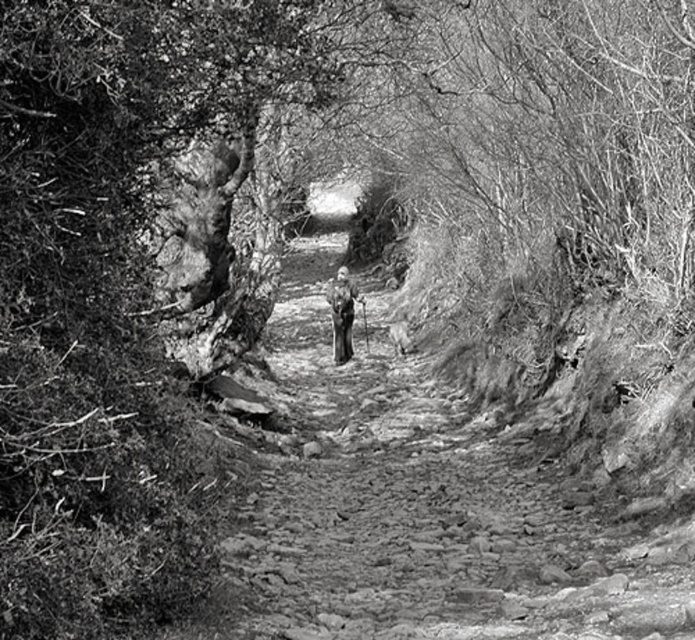
Does dirt path at center appear on the left side of dark gray fabric jacket at center?

In fact, dirt path at center is to the right of dark gray fabric jacket at center.

What do you see at coordinates (427, 509) in the screenshot? I see `dirt path at center` at bounding box center [427, 509].

Identify the location of dirt path at center. (427, 509).